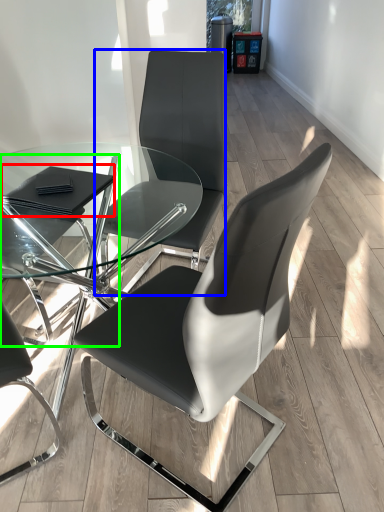
Question: Which is farther away from pad (highlighted by a red box)? chair (highlighted by a blue box) or chair (highlighted by a green box)?

Choices:
 (A) chair
 (B) chair

Answer: (A)